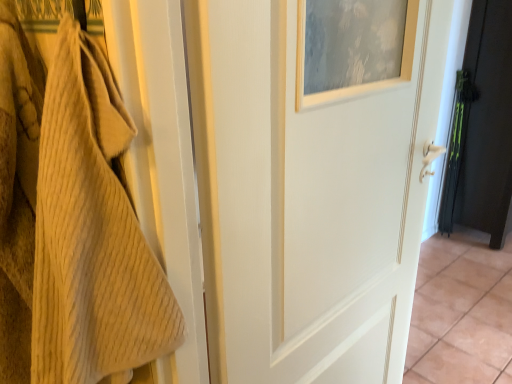
Find the location of a particular element. free space above white glossy tile at center (from a real-world perspective) is located at coordinates (465, 304).